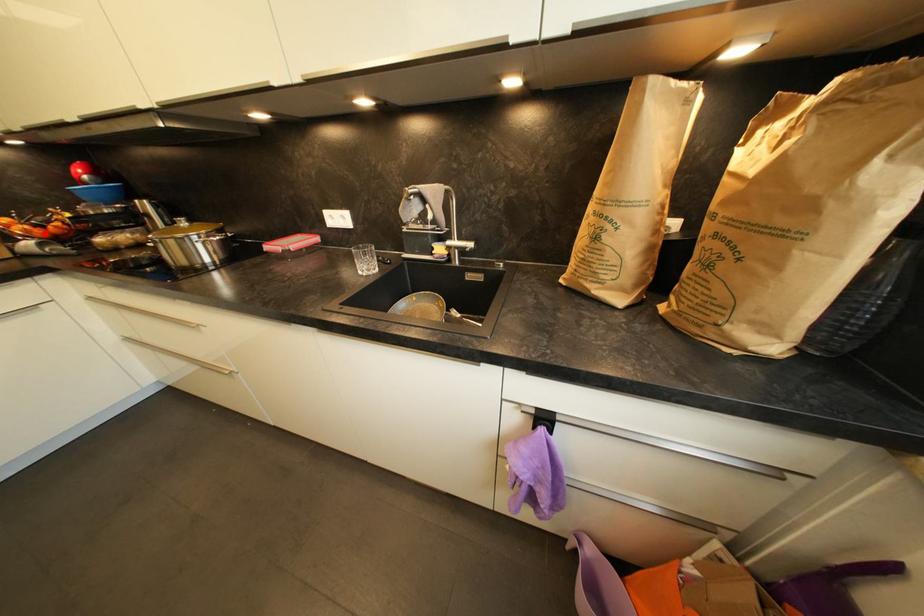
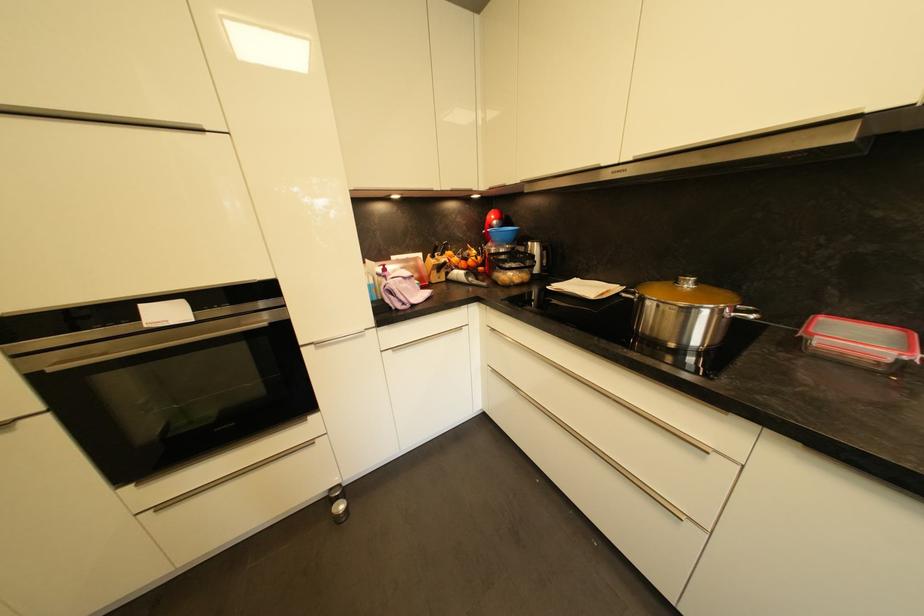
Question: I am providing you with two images of the same scene from different viewpoints. Given a red point in image1, look at the same physical point in image2. Is it:

Choices:
 (A) Closer to the viewpoint
 (B) Farther from the viewpoint

Answer: (A)